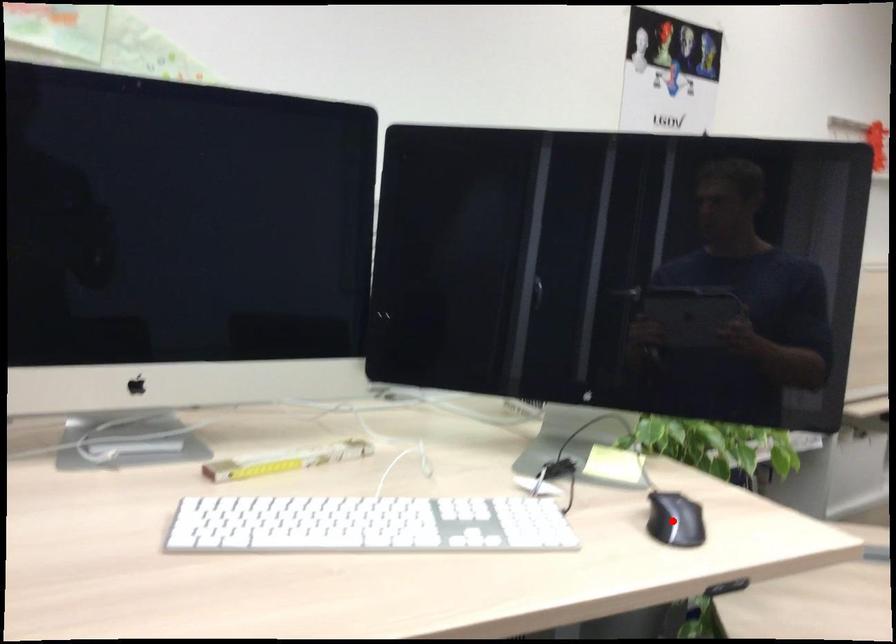
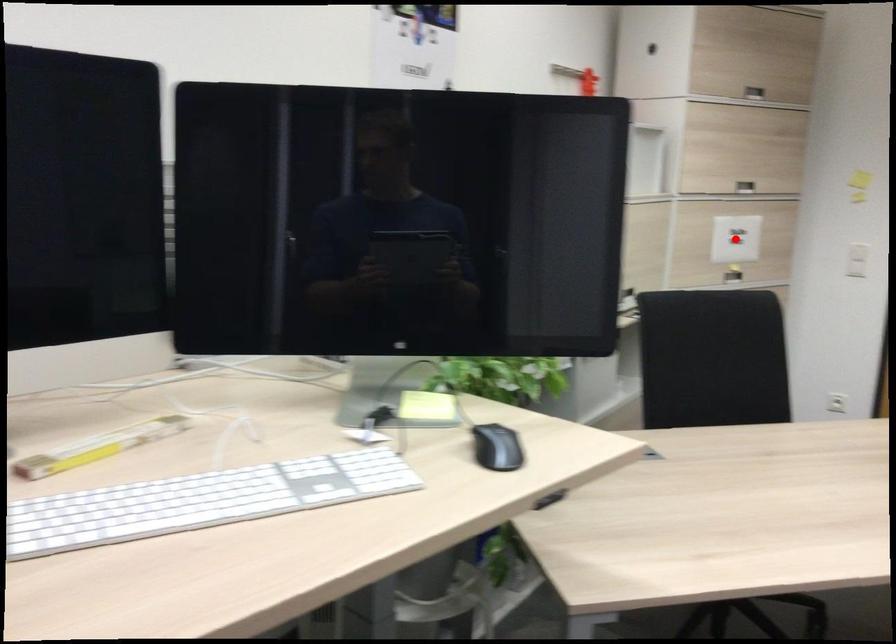
Consider the image. I am providing you with two images of the same scene from different viewpoints. A red point is marked on the first image and another point is marked on the second image. Is the red point in image1 aligned with the point shown in image2?

No